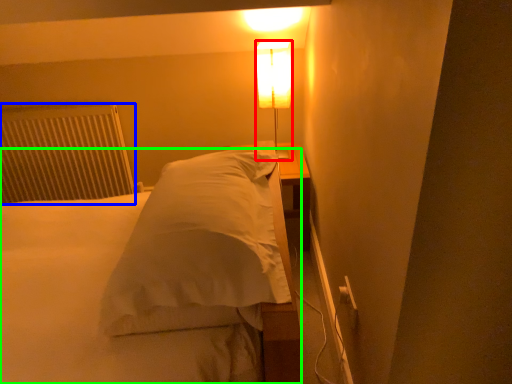
Question: Which is farther away from lamp (highlighted by a red box)? radiator (highlighted by a blue box) or bed (highlighted by a green box)?

Choices:
 (A) radiator
 (B) bed

Answer: (A)